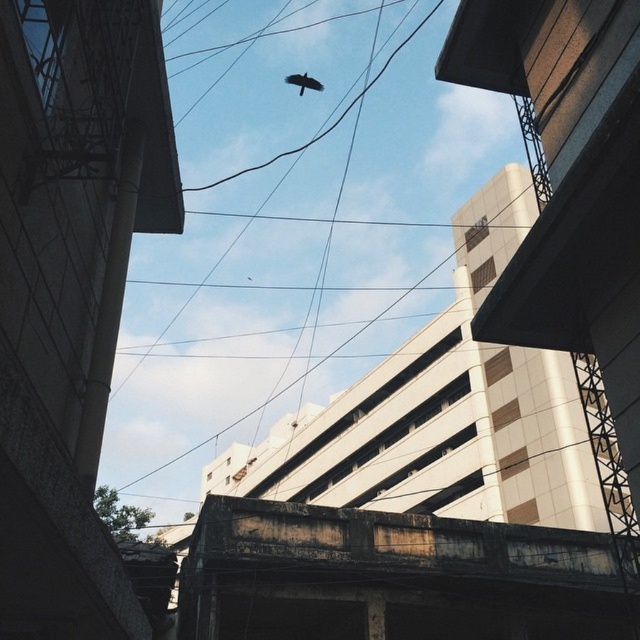
Question: Does rusty concrete overpass at center have a lesser width compared to dark brown feathered bird at center?

Choices:
 (A) no
 (B) yes

Answer: (A)

Question: Can you confirm if rusty concrete overpass at center is positioned below dark brown feathered bird at center?

Choices:
 (A) yes
 (B) no

Answer: (A)

Question: Which point is farther from the camera taking this photo?

Choices:
 (A) (291, 83)
 (B) (186, 557)

Answer: (A)

Question: Can you confirm if rusty concrete overpass at center is positioned above dark brown feathered bird at center?

Choices:
 (A) no
 (B) yes

Answer: (A)

Question: Which point is closer to the camera?

Choices:
 (A) rusty concrete overpass at center
 (B) dark brown feathered bird at center

Answer: (A)